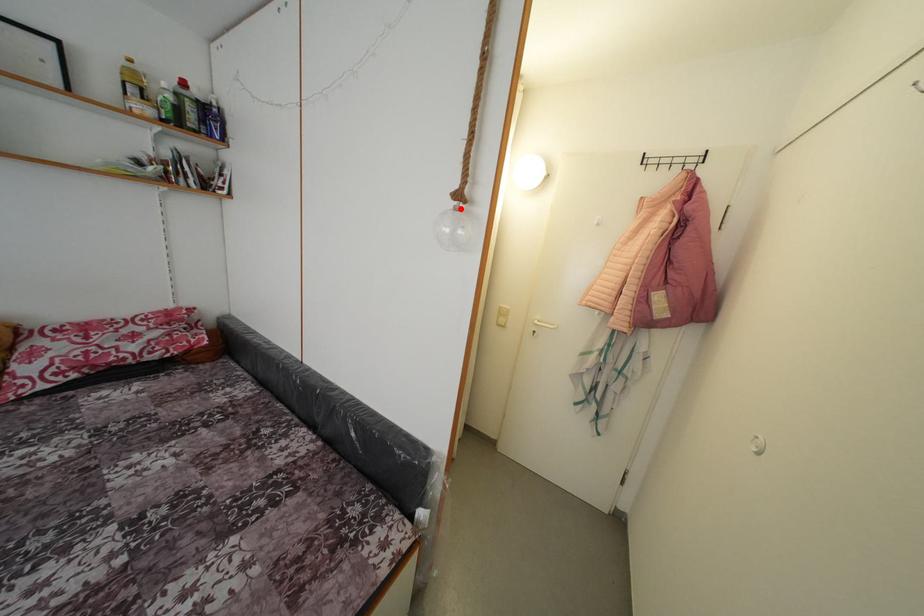
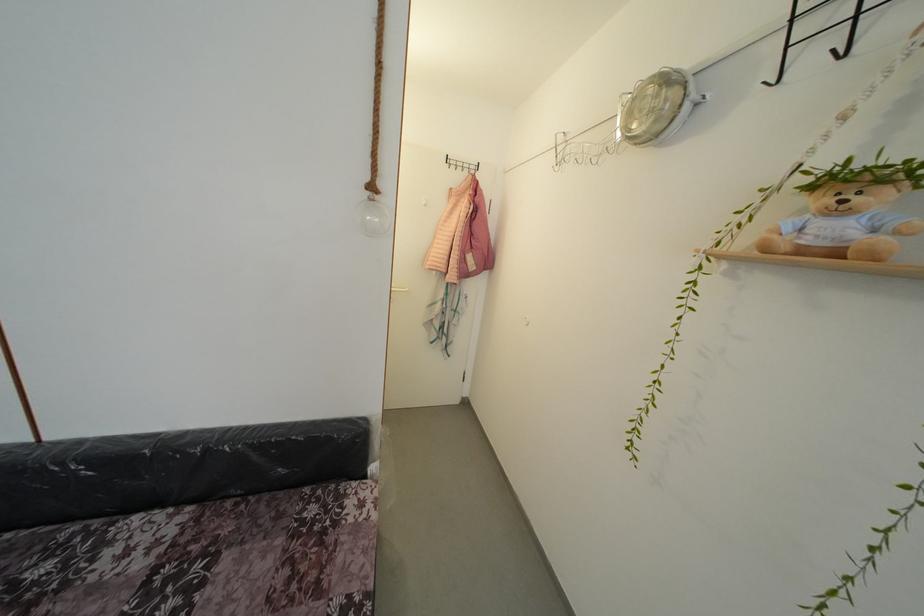
Where in the second image is the point corresponding to the highlighted location from the first image?

(373, 199)